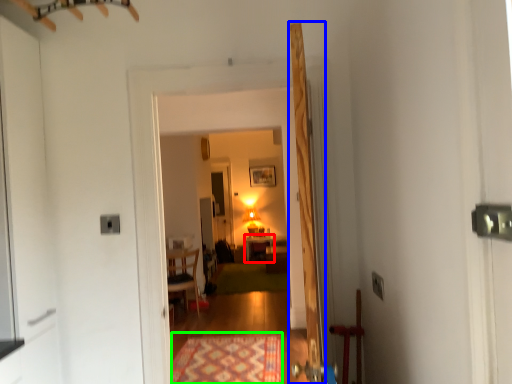
Question: Which is farther away from table (highlighted by a red box)? door (highlighted by a blue box) or mat (highlighted by a green box)?

Choices:
 (A) door
 (B) mat

Answer: (A)